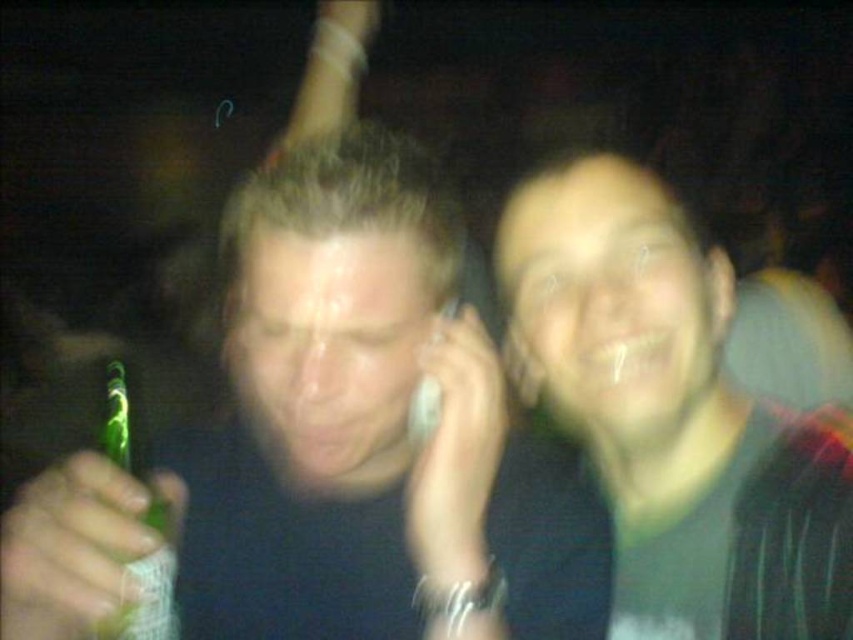
You are at a party and see two beverages on the table. You want to grab the one on the right. Which one should you pick between the green matte beer bottle at left and the green matte beer can at right?

You should pick the green matte beer can at right because it is positioned to the right of the green matte beer bottle at left.